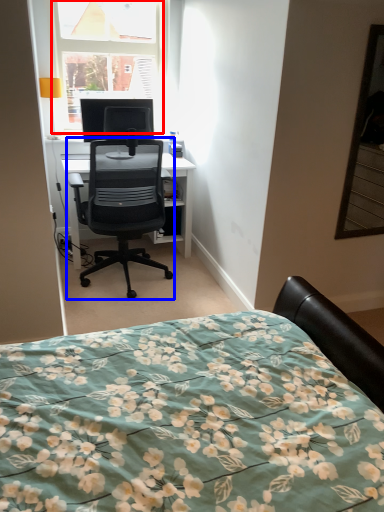
Question: Which point is closer to the camera, window (highlighted by a red box) or chair (highlighted by a blue box)?

Choices:
 (A) window
 (B) chair

Answer: (B)